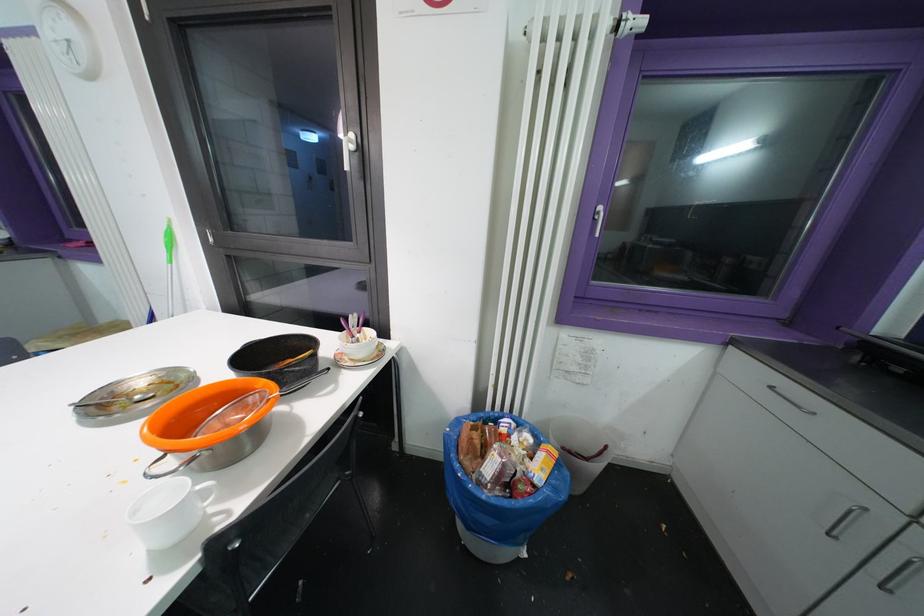
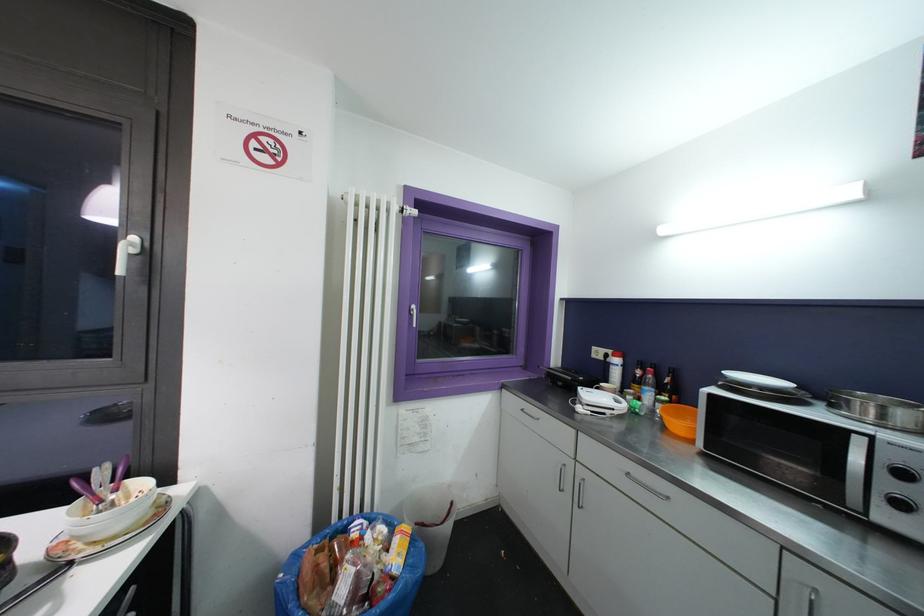
Where in the second image is the point corresponding to the point at 368,331 from the first image?

(131, 484)